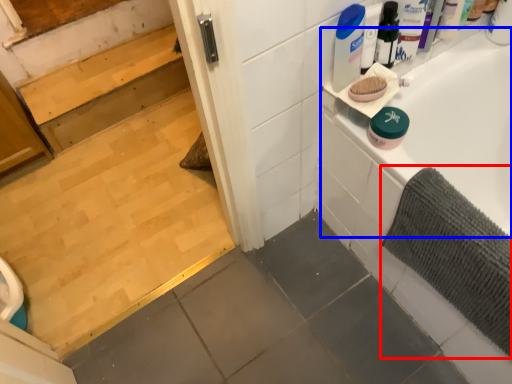
Question: Which object is further to the camera taking this photo, bath mat (highlighted by a red box) or bathtub (highlighted by a blue box)?

Choices:
 (A) bath mat
 (B) bathtub

Answer: (B)